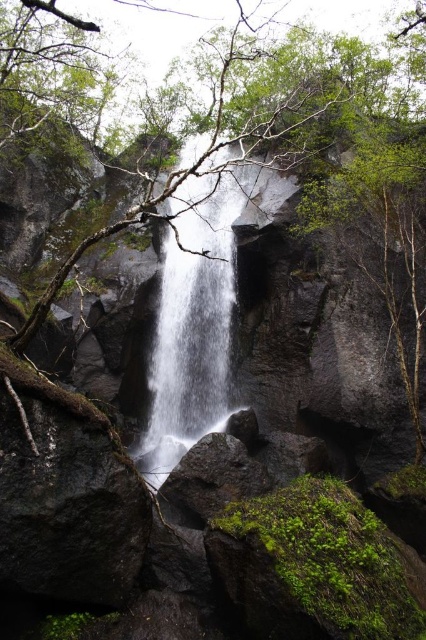
Question: Considering the relative positions of dark gray rock at center and white textured waterfall at center in the image provided, where is dark gray rock at center located with respect to white textured waterfall at center?

Choices:
 (A) below
 (B) above

Answer: (A)

Question: Estimate the real-world distances between objects in this image. Which object is farther from the dark gray rock at center?

Choices:
 (A) white textured waterfall at center
 (B) smooth bark tree at center

Answer: (B)

Question: Can you confirm if dark gray rock at center is wider than white textured waterfall at center?

Choices:
 (A) no
 (B) yes

Answer: (A)

Question: Does smooth bark tree at center have a smaller size compared to white textured waterfall at center?

Choices:
 (A) yes
 (B) no

Answer: (B)

Question: Which object is positioned closest to the smooth bark tree at center?

Choices:
 (A) white textured waterfall at center
 (B) dark gray rock at center

Answer: (A)

Question: Which of these objects is positioned closest to the smooth bark tree at center?

Choices:
 (A) dark gray rock at center
 (B) white textured waterfall at center

Answer: (B)